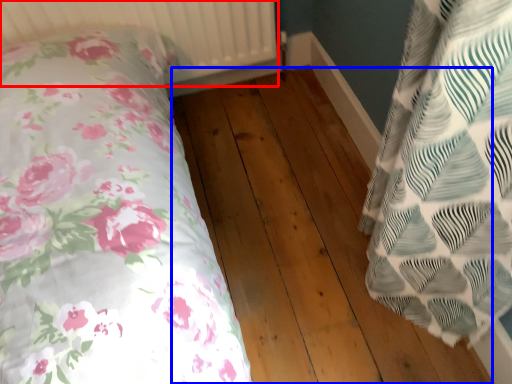
Question: Which object appears closest to the camera in this image, radiator (highlighted by a red box) or hardwood (highlighted by a blue box)?

Choices:
 (A) radiator
 (B) hardwood

Answer: (B)